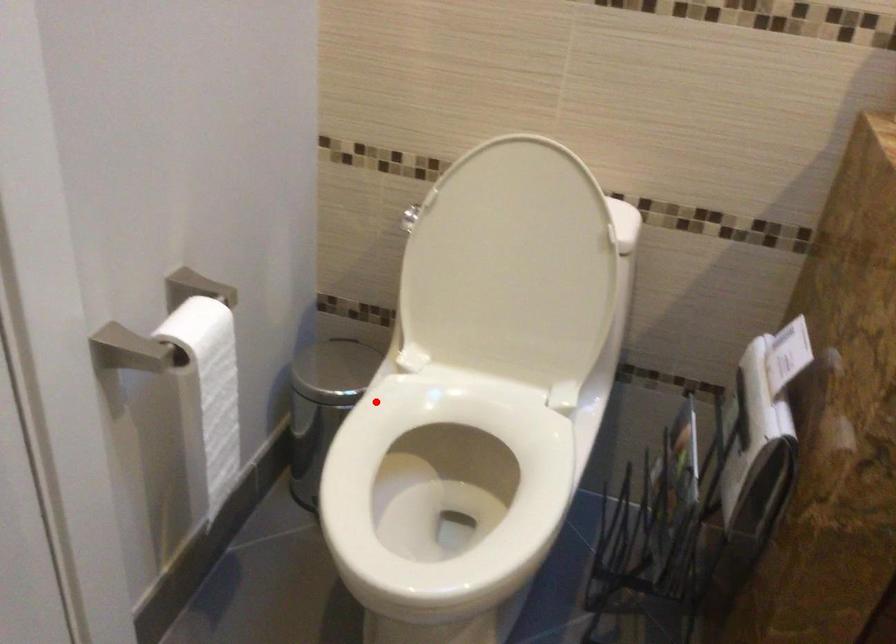
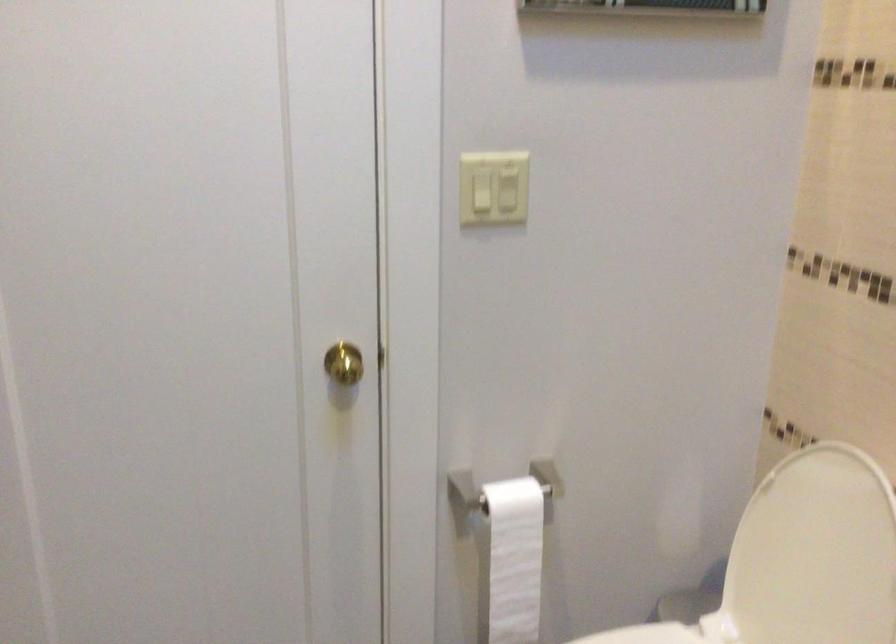
Find the pixel in the second image that matches the highlighted location in the first image.

(645, 635)